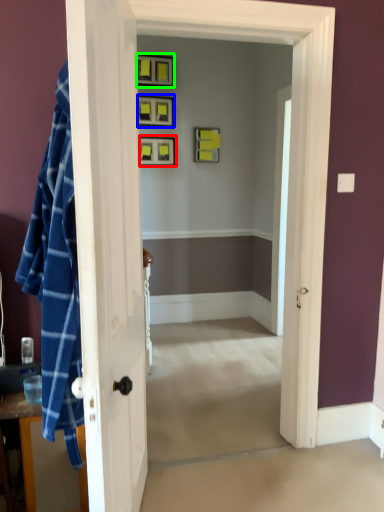
Question: Which object is the farthest from picture frame (highlighted by a red box)? Choose among these: picture frame (highlighted by a blue box) or picture frame (highlighted by a green box).

Choices:
 (A) picture frame
 (B) picture frame

Answer: (B)